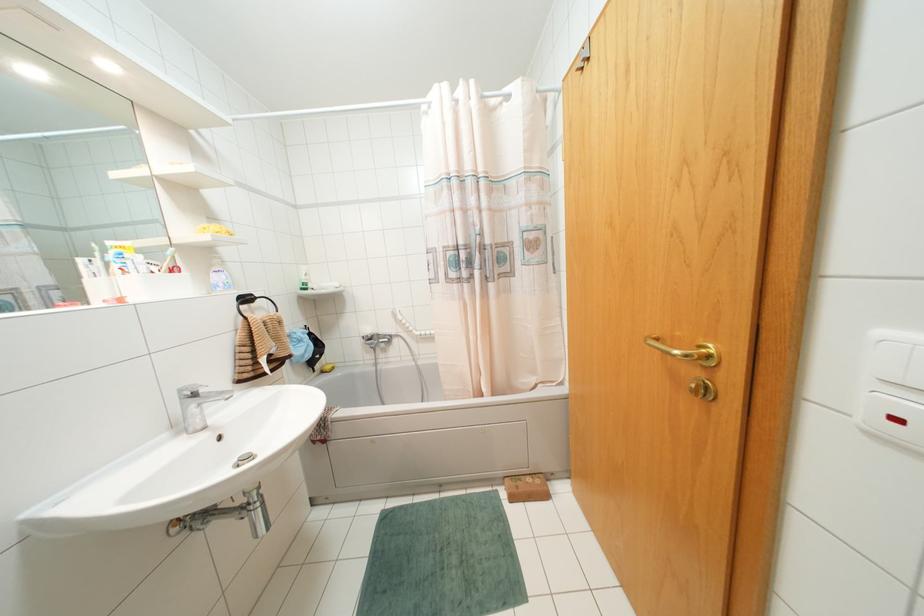
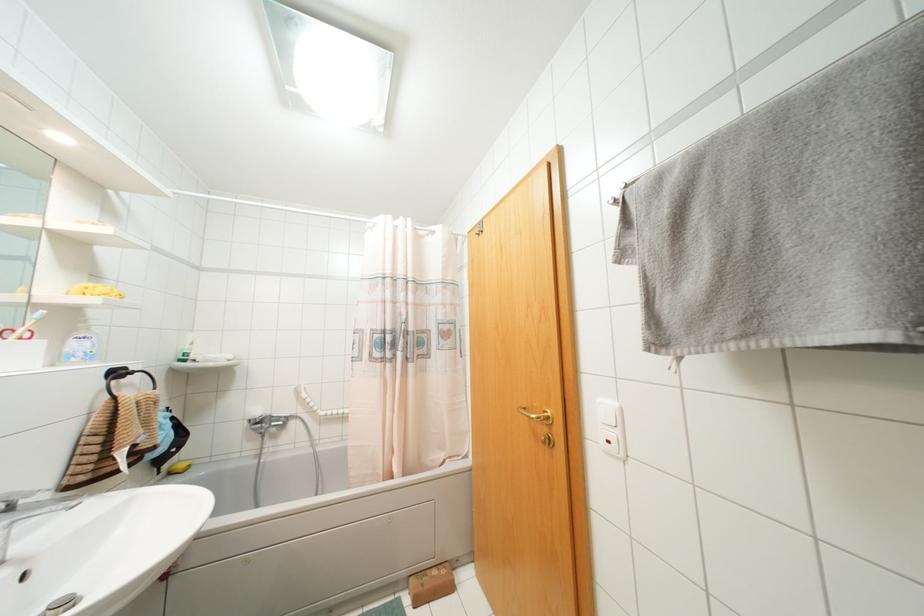
The point at (709, 355) is marked in the first image. Where is the corresponding point in the second image?

(546, 416)